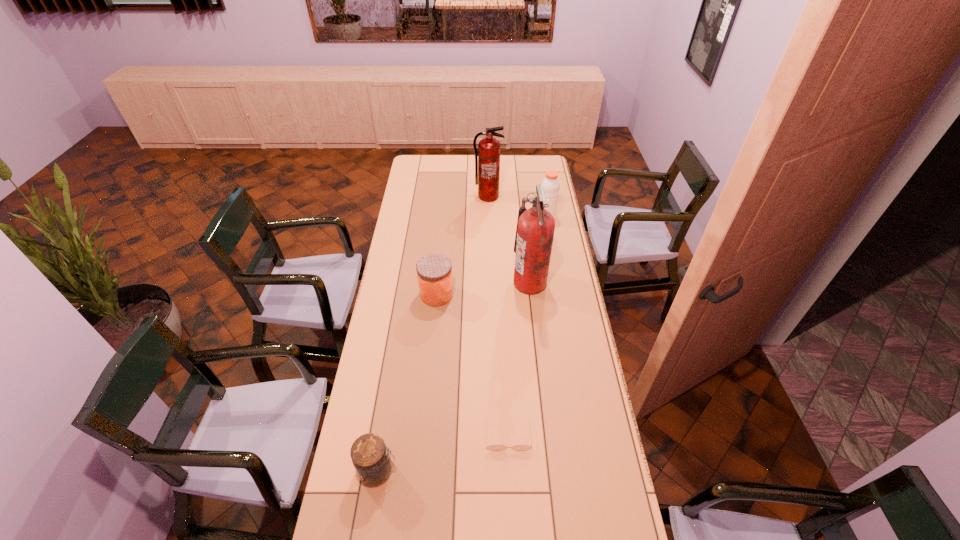
This screenshot has width=960, height=540. In order to click on vacant area that lies between the fourth shortest object and the fifth farthest object in this screenshot , I will do click(x=527, y=328).

Find the location of a particular element. Image resolution: width=960 pixels, height=540 pixels. free area in between the rightmost object and the shorter jar is located at coordinates (462, 345).

Where is `object that can be found as the third closest to the second tallest object`? This screenshot has height=540, width=960. object that can be found as the third closest to the second tallest object is located at coordinates (434, 271).

Identify which object is the third closest to the nearer fire extinguisher. Please provide its 2D coordinates. Your answer should be formatted as a tuple, i.e. [(x, y)], where the tuple contains the x and y coordinates of a point satisfying the conditions above.

[(487, 162)]

Find the location of a particular element. The height and width of the screenshot is (540, 960). free location that satisfies the following two spatial constraints: 1. on the front of the taller fire extinguisher near the operation label; 2. on the face of the fifth farthest object is located at coordinates (547, 435).

Identify the location of vacant space that satisfies the following two spatial constraints: 1. on the front side of the rightmost object; 2. on the lid of the left jar. (589, 470).

Find the location of `vacant position in the image that satisfies the following two spatial constraints: 1. on the front side of the shaker; 2. on the front of the nearer fire extinguisher near the operation label`. vacant position in the image that satisfies the following two spatial constraints: 1. on the front side of the shaker; 2. on the front of the nearer fire extinguisher near the operation label is located at coordinates (557, 283).

This screenshot has height=540, width=960. In order to click on vacant area in the image that satisfies the following two spatial constraints: 1. on the back side of the farther jar; 2. on the right side of the fourth shortest object in this screenshot , I will do `click(444, 220)`.